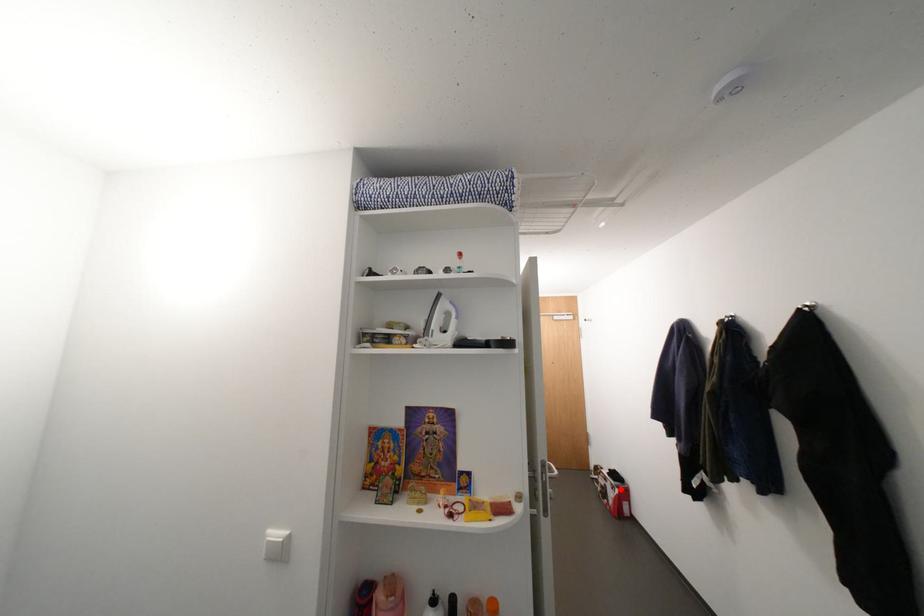
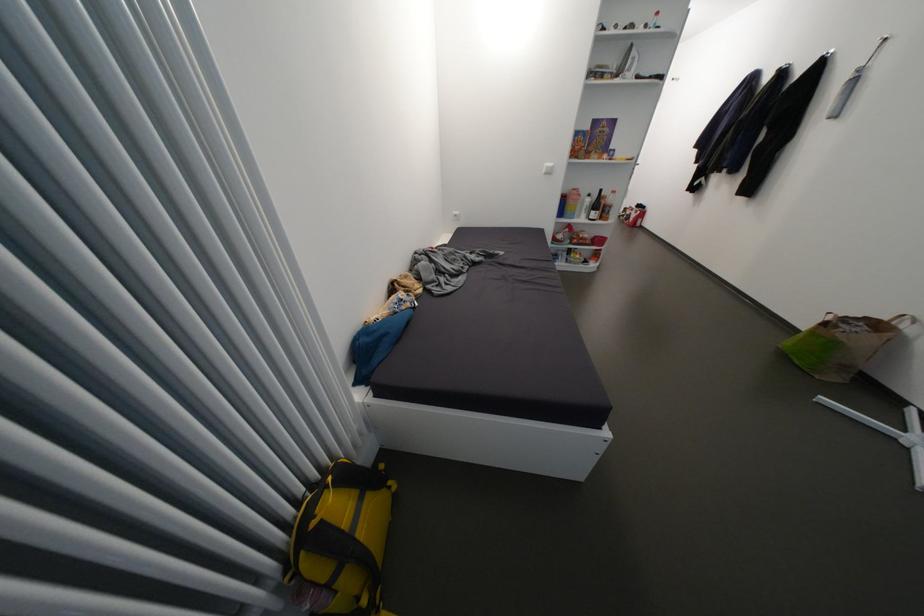
Question: I am providing you with two images of the same scene from different viewpoints. In image1, a red point is highlighted. Considering the same 3D point in image2, which of the following is correct?

Choices:
 (A) It is closer
 (B) It is farther

Answer: (B)